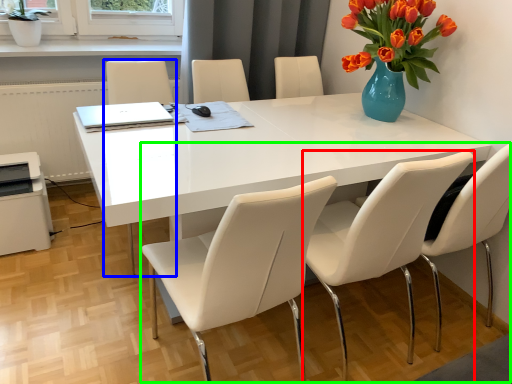
Question: Considering the real-world distances, which object is closest to chair (highlighted by a red box)? armchair (highlighted by a blue box) or trio (highlighted by a green box).

Choices:
 (A) armchair
 (B) trio

Answer: (B)